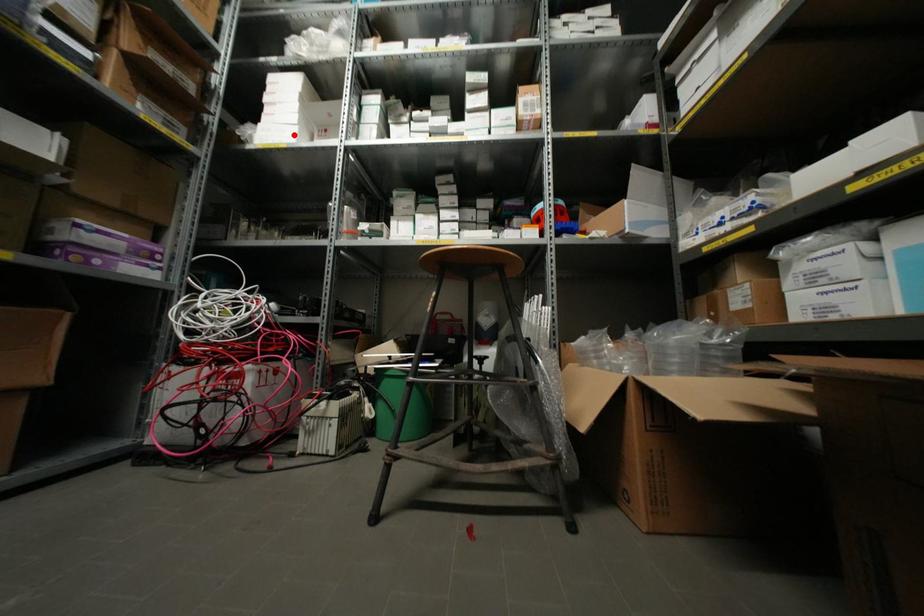
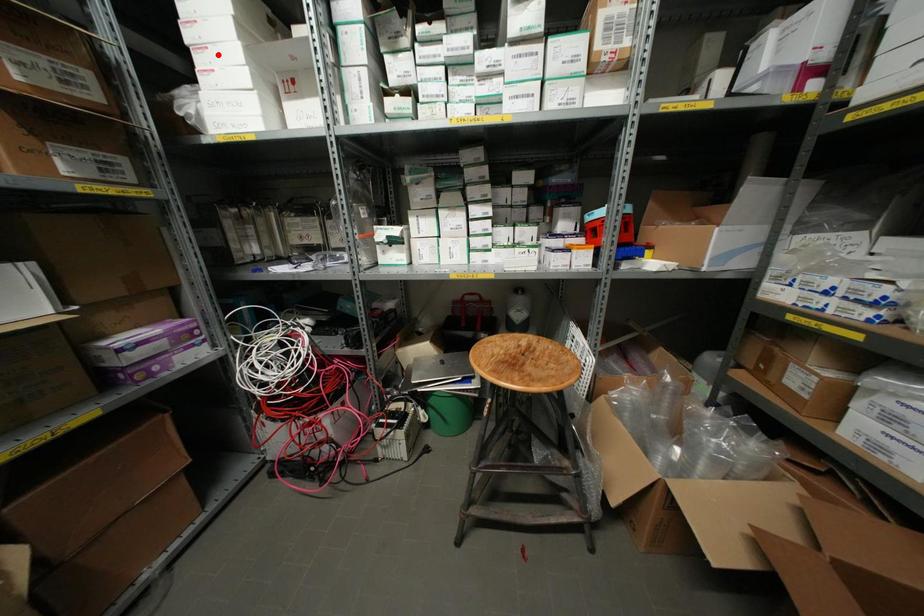
In the scene shown: I am providing you with two images of the same scene from different viewpoints. A red point is marked on the first image and another point is marked on the second image. Are the points marked in image1 and image2 representing the same 3D position?

No